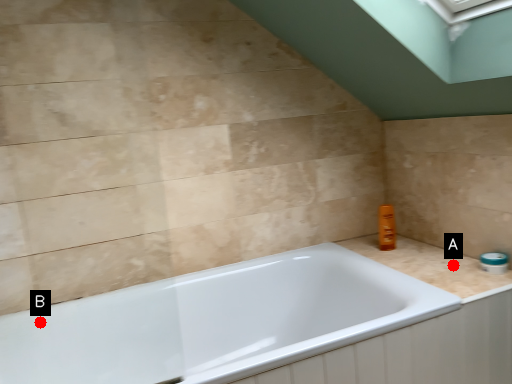
Question: Two points are circled on the image, labeled by A and B beside each circle. Which of the following is the farthest from the observer?

Choices:
 (A) A is further
 (B) B is further

Answer: (A)